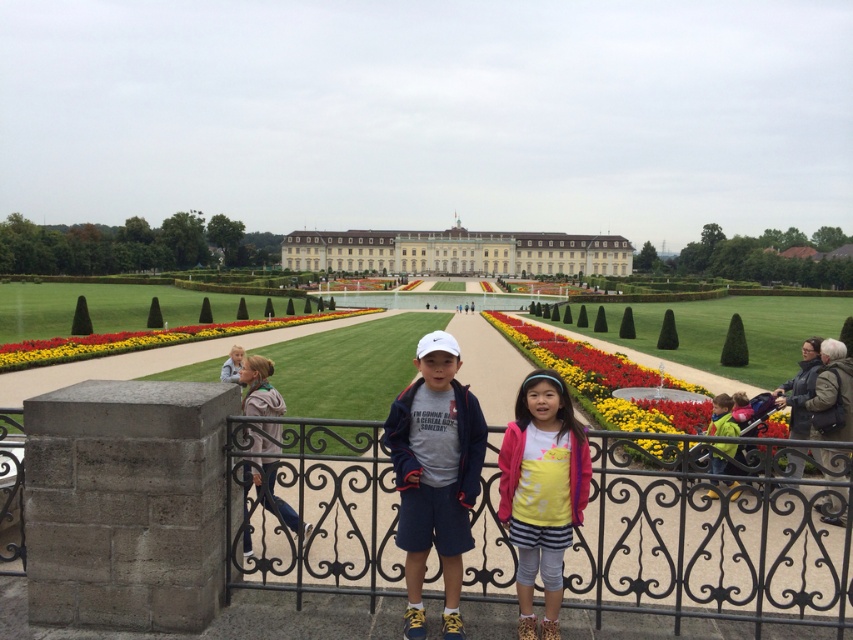
Is point (547, 456) in front of point (73, 348)?

Yes, point (547, 456) is closer to viewer.

Can you confirm if matte pink jacket at center is shorter than floral carpet at center?

In fact, matte pink jacket at center may be taller than floral carpet at center.

This screenshot has width=853, height=640. In order to click on matte pink jacket at center in this screenshot , I will do `click(543, 490)`.

This screenshot has width=853, height=640. What are the coordinates of `matte pink jacket at center` in the screenshot? It's located at [x=543, y=490].

Does white stone palace at center have a greater width compared to light pink fabric jacket at lower right?

Yes.

Looking at this image, who is shorter, white stone palace at center or light pink fabric jacket at lower right?

Standing shorter between the two is light pink fabric jacket at lower right.

The image size is (853, 640). In order to click on white stone palace at center in this screenshot , I will do (457, 252).

Identify the location of white stone palace at center. This screenshot has width=853, height=640. (457, 252).

Is point (329, 554) more distant than point (248, 381)?

No, (329, 554) is closer to viewer.

The image size is (853, 640). Find the location of `iron wrought fence at center`. iron wrought fence at center is located at coordinates (704, 536).

Find the location of a particular element. iron wrought fence at center is located at coordinates (704, 536).